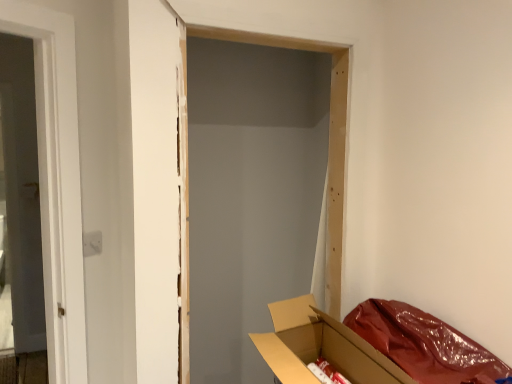
Question: Is cardboard box at lower right wider than white fabric curtain at right?

Choices:
 (A) yes
 (B) no

Answer: (A)

Question: Is cardboard box at lower right positioned with its back to white fabric curtain at right?

Choices:
 (A) no
 (B) yes

Answer: (A)

Question: Is cardboard box at lower right bigger than white fabric curtain at right?

Choices:
 (A) yes
 (B) no

Answer: (A)

Question: Is cardboard box at lower right not inside white fabric curtain at right?

Choices:
 (A) yes
 (B) no

Answer: (A)

Question: Is white fabric curtain at right a part of cardboard box at lower right?

Choices:
 (A) yes
 (B) no

Answer: (B)

Question: Does cardboard box at lower right come in front of white fabric curtain at right?

Choices:
 (A) no
 (B) yes

Answer: (B)

Question: Is white fabric curtain at right bigger than cardboard box at lower right?

Choices:
 (A) yes
 (B) no

Answer: (B)

Question: Is white fabric curtain at right outside cardboard box at lower right?

Choices:
 (A) no
 (B) yes

Answer: (B)

Question: Is white fabric curtain at right wider than cardboard box at lower right?

Choices:
 (A) no
 (B) yes

Answer: (A)

Question: Is white fabric curtain at right closer to the viewer compared to cardboard box at lower right?

Choices:
 (A) no
 (B) yes

Answer: (A)

Question: Can you confirm if white fabric curtain at right is positioned to the right of cardboard box at lower right?

Choices:
 (A) no
 (B) yes

Answer: (B)

Question: From a real-world perspective, is white fabric curtain at right positioned over cardboard box at lower right based on gravity?

Choices:
 (A) yes
 (B) no

Answer: (A)

Question: Is cardboard box at lower right in front of or behind white fabric curtain at right in the image?

Choices:
 (A) behind
 (B) front

Answer: (B)